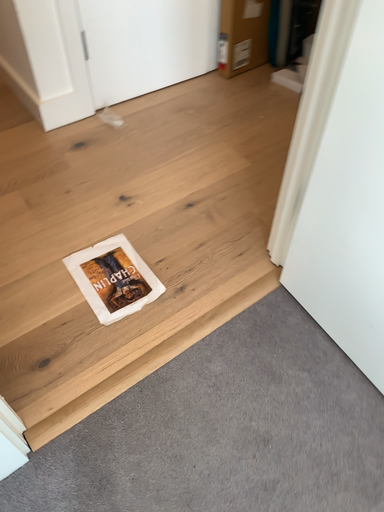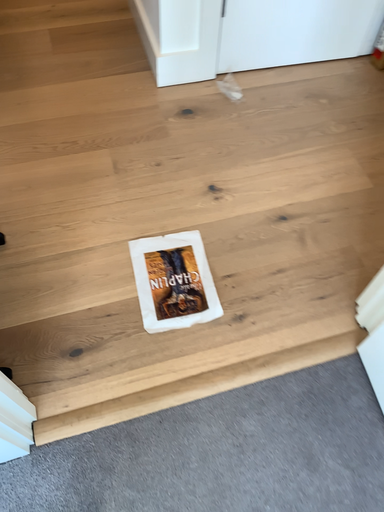
Question: Which way did the camera rotate in the video?

Choices:
 (A) rotated left
 (B) rotated right

Answer: (A)